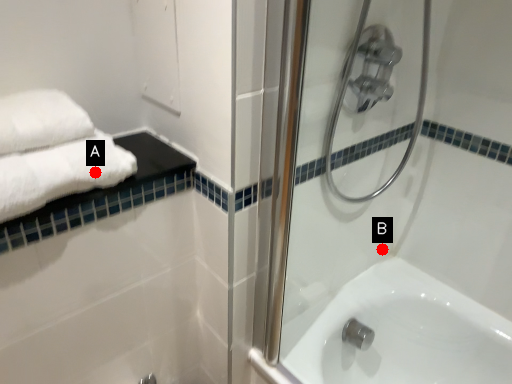
Question: Two points are circled on the image, labeled by A and B beside each circle. Which of the following is the closest to the observer?

Choices:
 (A) A is closer
 (B) B is closer

Answer: (A)